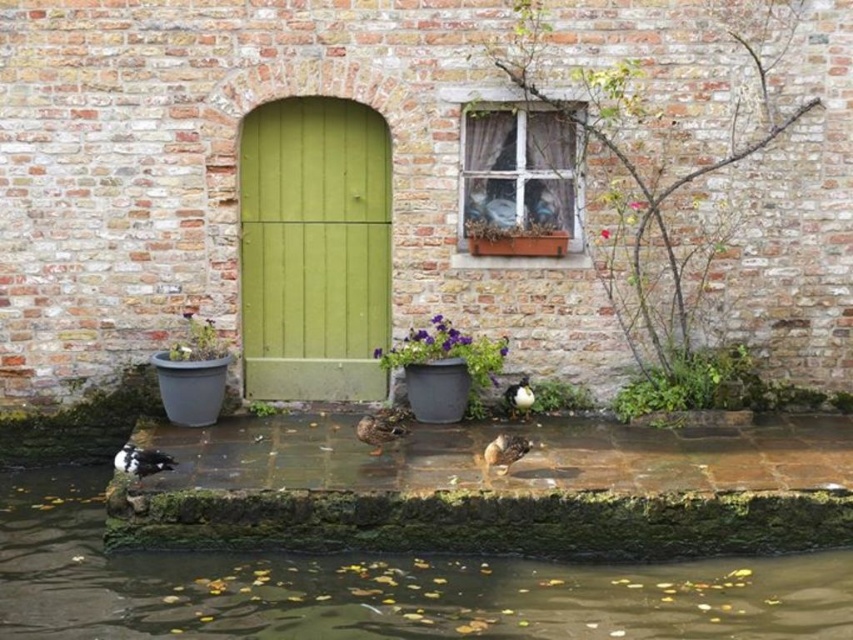
You are a delivery person with a package that requires a 6 feet wide path to maneuver. You are standing in front of the green wooden door at center and need to reach the green leafy plant at lower right. Is the space between them sufficient for your delivery vehicle?

The distance between the green wooden door at center and the green leafy plant at lower right is 7.89 feet, which is wider than the required 6 feet. Therefore, the delivery vehicle can maneuver through the space between them.

You are standing in front of the brick wall with the green door and window. There is a point marked at coordinates (378, 588). Based on the scene, where is this point located?

The point is located on the brown mossy water at lower center.

You are a gardener who wants to place a new small statue between the green leafy plant at upper right and the purple flowerpot at center. Which object should you place the statue closer to if you want it to be closer to the taller object?

The green leafy plant at upper right is taller than the purple flowerpot at center, so you should place the statue closer to the green leafy plant at upper right to be near the taller object.